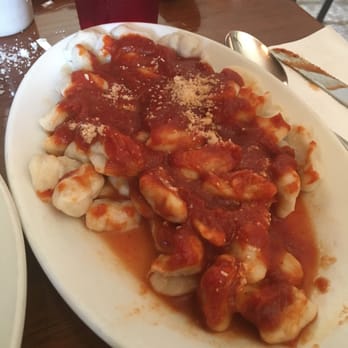
This screenshot has height=348, width=348. Find the location of `spilled on table`. spilled on table is located at coordinates (22, 55), (19, 56), (12, 57), (1, 51), (27, 45), (13, 70).